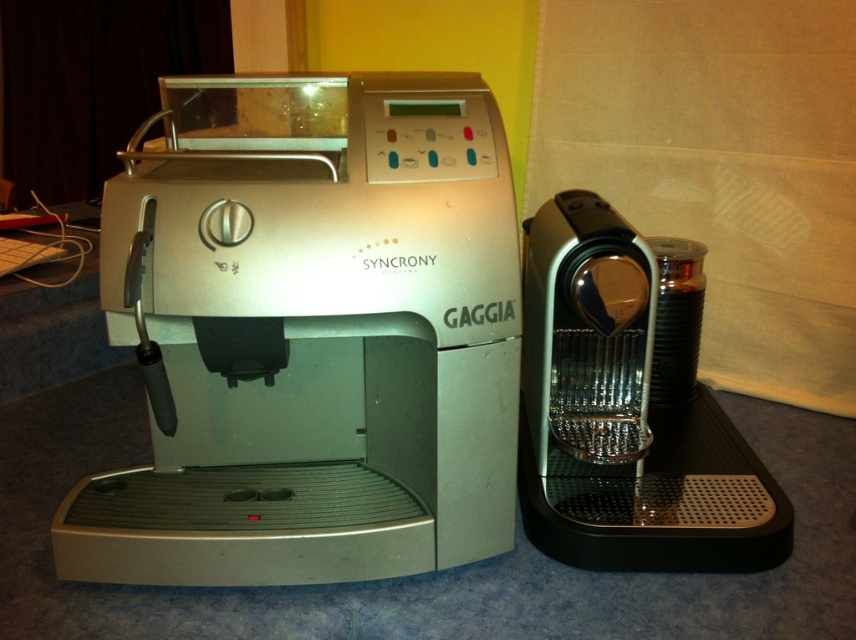
Can you confirm if silver metallic espresso machine at left is shorter than metallic silver coffee machine at right?

No.

Can you confirm if silver metallic espresso machine at left is bigger than metallic silver coffee machine at right?

Indeed, silver metallic espresso machine at left has a larger size compared to metallic silver coffee machine at right.

Where is `silver metallic espresso machine at left`? silver metallic espresso machine at left is located at coordinates (311, 333).